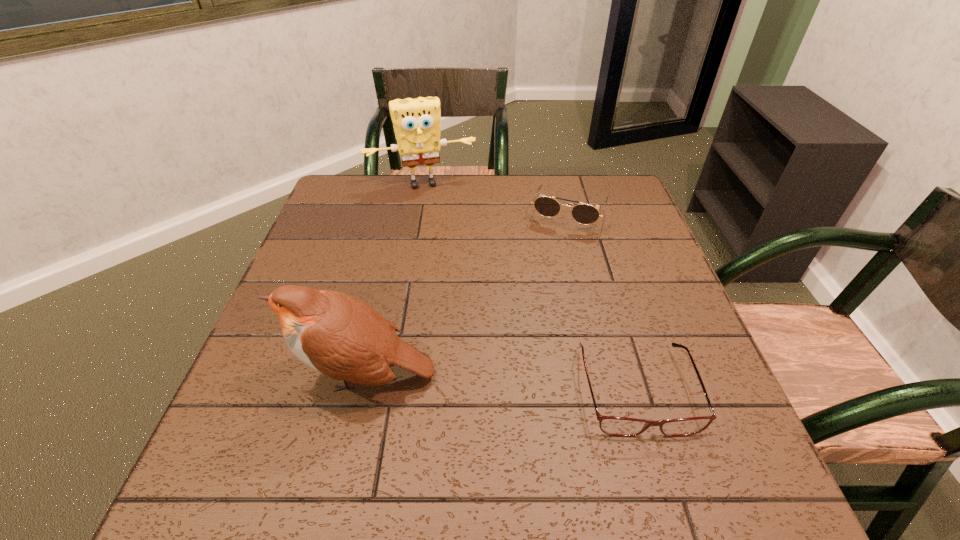
Image resolution: width=960 pixels, height=540 pixels. Find the location of `free space on the desktop that is between the bird and the spectacles and is positioned on the front lenses of the second shortest object`. free space on the desktop that is between the bird and the spectacles and is positioned on the front lenses of the second shortest object is located at coordinates (506, 383).

The image size is (960, 540). I want to click on free space on the desktop that is between the bird and the shortest object and is positioned on the face of the sponge, so [x=477, y=381].